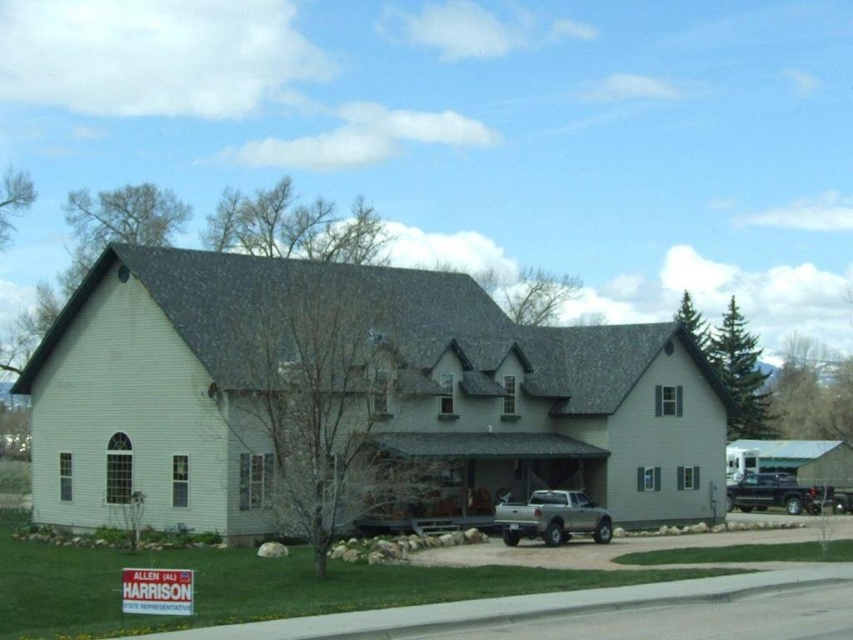
You are a delivery driver who needs to park your vehicle in the driveway of the house shown. You have two trucks available, a silver metallic truck at lower center and a shiny black truck at lower right. Based on their sizes, which truck would be more suitable for the driveway without blocking the entrance?

The silver metallic truck at lower center is not as tall as the shiny black truck at lower right, so the silver metallic truck at lower center would be more suitable for the driveway as it is shorter and less likely to block the entrance.

You are a delivery driver approaching the house and see the silver metallic truck at lower center and the shiny black truck at lower right. Which truck should you park to the right of to avoid blocking the driveway?

You should park to the right of the shiny black truck at lower right because the silver metallic truck at lower center is already to the left of it, so parking further to the right would keep the driveway clear.